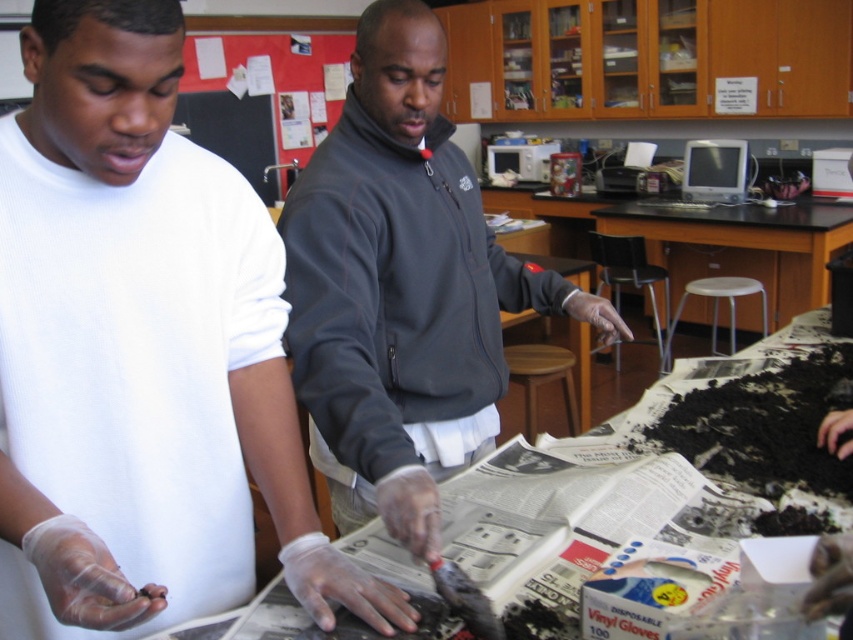
Question: Which object is positioned closest to the white paper at center?

Choices:
 (A) transparent plastic gloves at lower center
 (B) white plastic stool at center
 (C) red paperboard at upper left

Answer: (A)

Question: In this image, where is transparent plastic gloves at lower center located relative to white plastic stool at center?

Choices:
 (A) right
 (B) left

Answer: (B)

Question: Can you confirm if white paper at center is thinner than wooden stool at center?

Choices:
 (A) no
 (B) yes

Answer: (A)

Question: Which object appears farthest from the camera in this image?

Choices:
 (A) wooden stool at center
 (B) red paperboard at upper left

Answer: (B)

Question: Is white paper at center behind wooden stool at center?

Choices:
 (A) yes
 (B) no

Answer: (B)

Question: Which point is farther to the camera?

Choices:
 (A) red paperboard at upper left
 (B) white paper at center

Answer: (A)